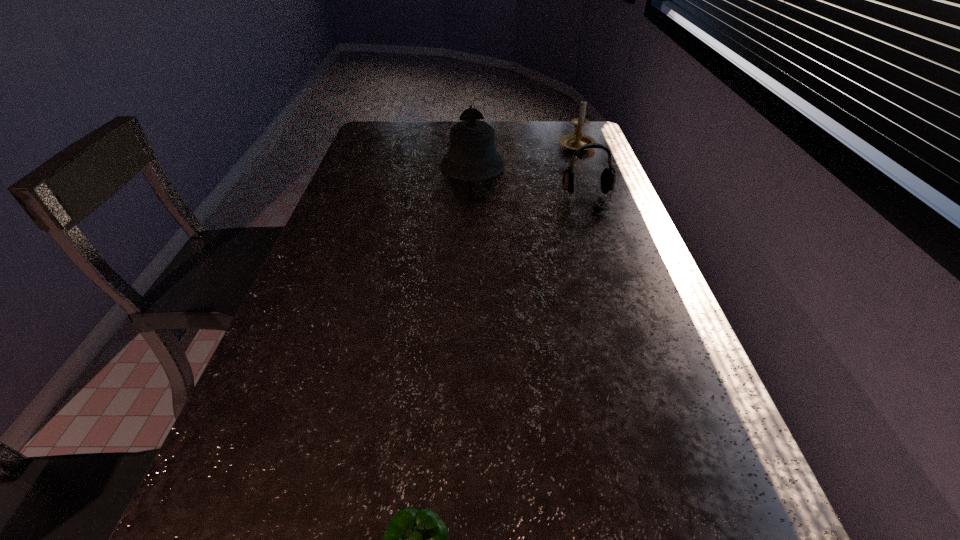
The width and height of the screenshot is (960, 540). I want to click on bell, so [x=472, y=156].

You are a GUI agent. You are given a task and a screenshot of the screen. Output one action in this format:
    pyautogui.click(x=<x>, y=<y>)
    Task: Click on the candle holder
    The width and height of the screenshot is (960, 540).
    Given the screenshot: What is the action you would take?
    pyautogui.click(x=572, y=141)

Find the location of a particular element. This screenshot has width=960, height=540. headset is located at coordinates (608, 177).

Identify the location of vacant space located 0.140m on the left of the tallest object. (398, 165).

Find the location of a particular element. The image size is (960, 540). vacant region located 0.110m with a handle on the side of the candle holder is located at coordinates (568, 123).

I want to click on vacant space situated with the microphone on the side of the headset, so click(x=620, y=296).

You are a GUI agent. You are given a task and a screenshot of the screen. Output one action in this format:
    pyautogui.click(x=<x>, y=<y>)
    Task: Click on the object that is at the far edge
    The width and height of the screenshot is (960, 540).
    Given the screenshot: What is the action you would take?
    pyautogui.click(x=572, y=141)

Identify the location of candle holder located in the right edge section of the desktop. This screenshot has width=960, height=540. (572, 141).

Locate an element on the screen. The image size is (960, 540). headset positioned at the right edge is located at coordinates (608, 177).

Where is `object present at the far right corner`? The image size is (960, 540). object present at the far right corner is located at coordinates (572, 141).